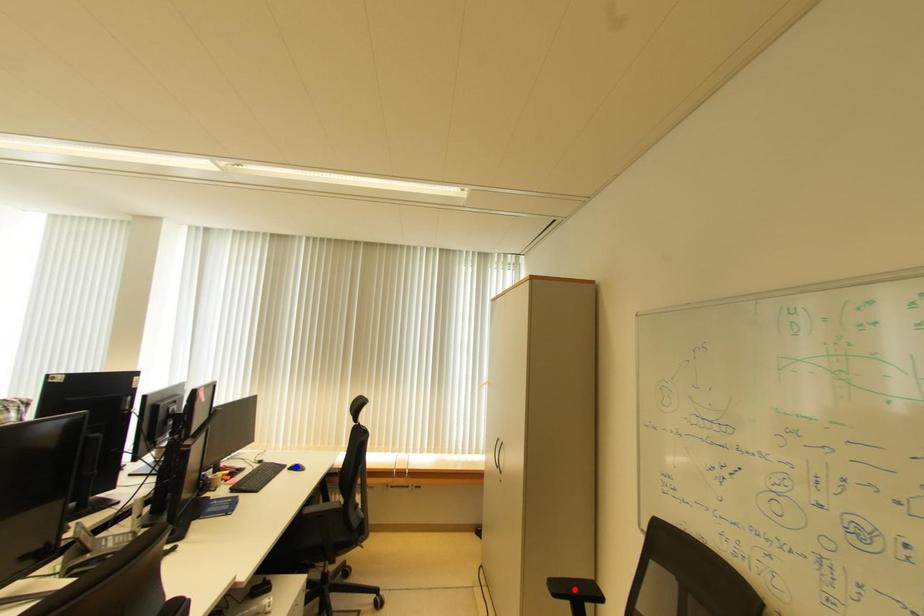
Question: Two points are marked on the image. Which point is closer to the camera?

Choices:
 (A) Blue point is closer.
 (B) Red point is closer.

Answer: (B)